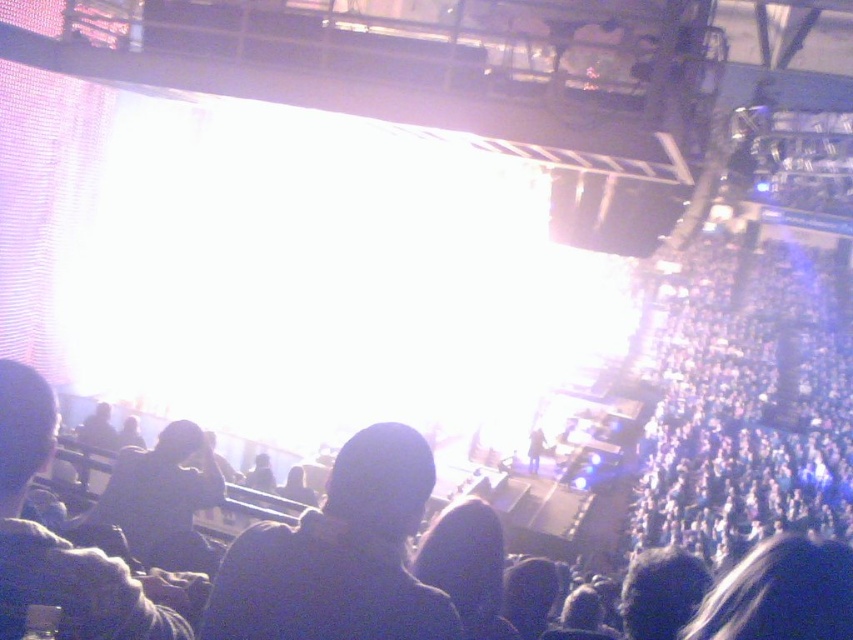
You are a photographer trying to capture a clear shot of the dark fabric hat at left without the black matte crowd at center blocking it. Based on their relative heights, is this possible?

The black matte crowd at center has a greater height compared to the dark fabric hat at left, so it is likely blocking the view of the dark fabric hat at left.

You are a photographer trying to capture a clear shot of the dark fabric hat at left without the black matte crowd at center blocking it. What adjustment should you make to your camera position?

To capture the dark fabric hat at left without the black matte crowd at center blocking it, you should move your camera position closer to the dark fabric hat at left since the black matte crowd at center is further away and might be in front of it.